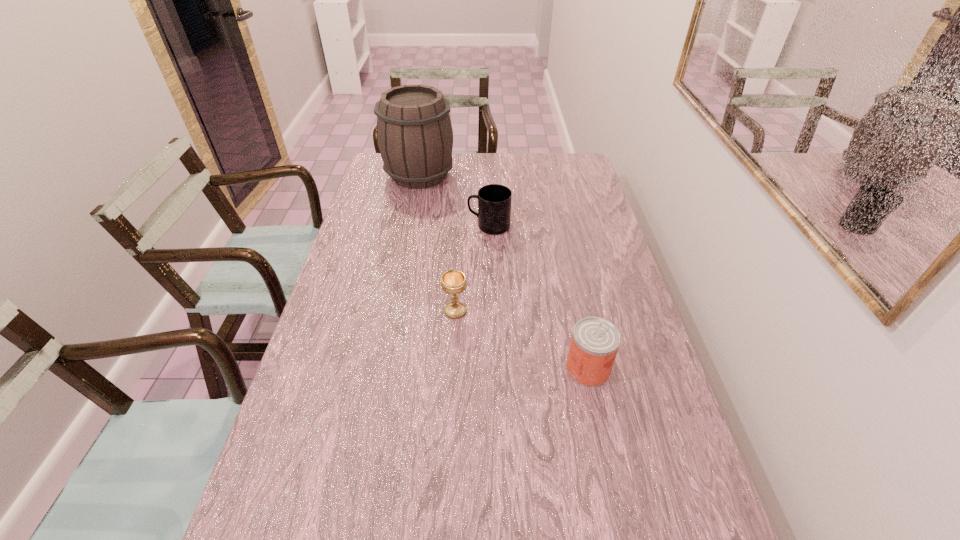
The width and height of the screenshot is (960, 540). I want to click on the farthest object, so click(414, 132).

This screenshot has height=540, width=960. In order to click on wine bucket in this screenshot , I will do click(414, 132).

Where is `mug`? mug is located at coordinates (494, 201).

This screenshot has width=960, height=540. I want to click on the rightmost object, so click(595, 341).

Find the location of `can`. can is located at coordinates 595,341.

This screenshot has width=960, height=540. Find the location of `chalice`. chalice is located at coordinates (453, 282).

The width and height of the screenshot is (960, 540). Identify the location of free region located 0.200m on the front of the farthest object. (410, 225).

Identify the location of vacant space located 0.220m on the side of the second farthest object with the handle. pyautogui.click(x=406, y=226).

Identify the location of vacant space located on the side of the second farthest object with the handle. This screenshot has height=540, width=960. (357, 226).

Locate an element on the screen. The height and width of the screenshot is (540, 960). vacant region located 0.180m on the side of the second farthest object with the handle is located at coordinates (417, 226).